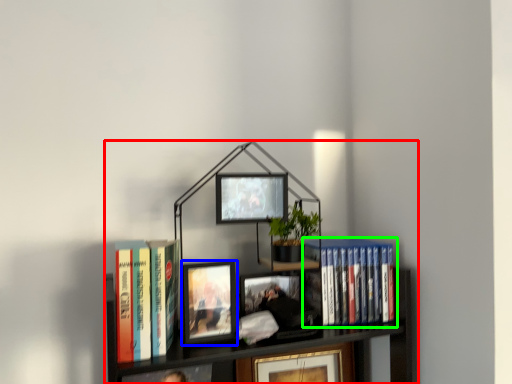
Question: Which is farther away from bookcase (highlighted by a red box)? picture frame (highlighted by a blue box) or book (highlighted by a green box)?

Choices:
 (A) picture frame
 (B) book

Answer: (A)